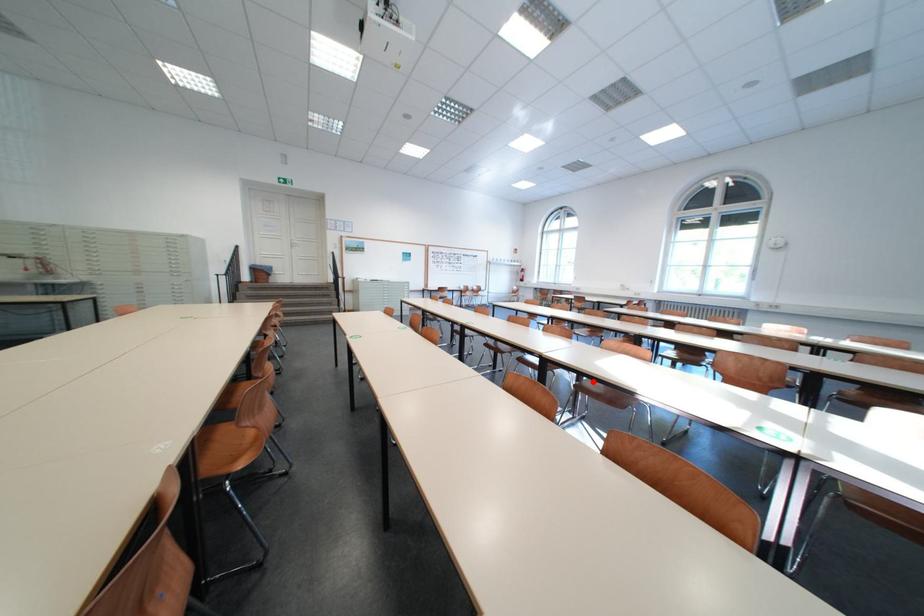
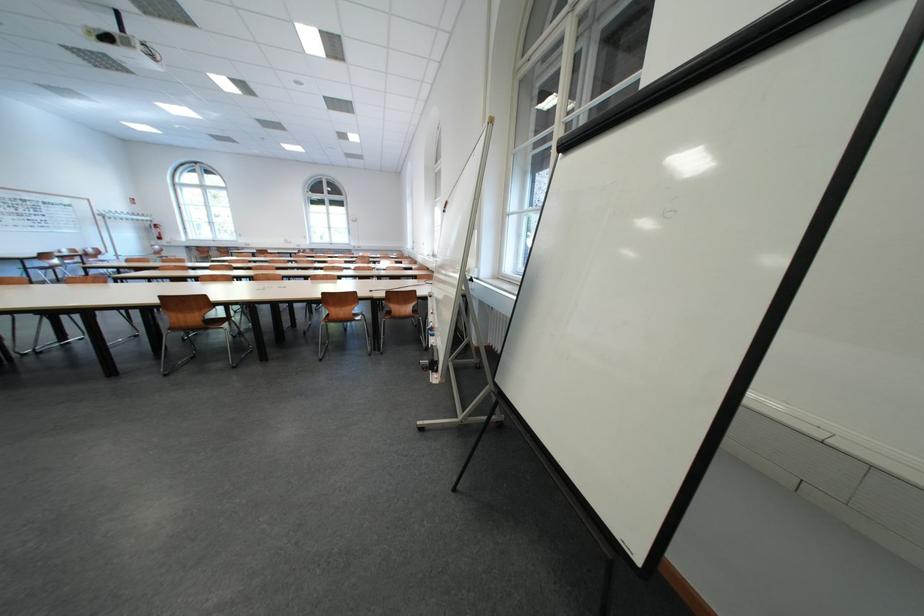
Question: I am providing you with two images of the same scene from different viewpoints. A red point is marked on the first image. Is the red point's position out of view in image 2?

Choices:
 (A) Yes
 (B) No

Answer: (A)